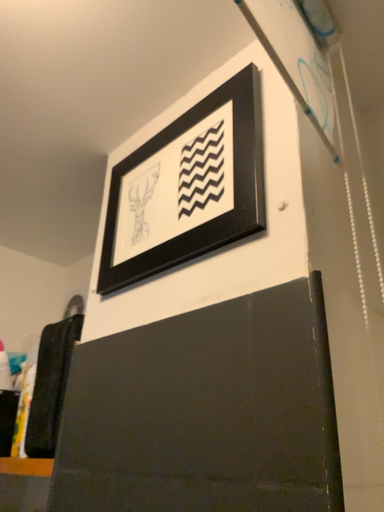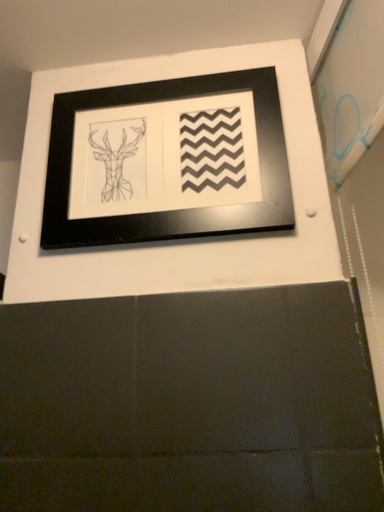
Question: How did the camera likely rotate when shooting the video?

Choices:
 (A) rotated downward
 (B) rotated upward

Answer: (A)